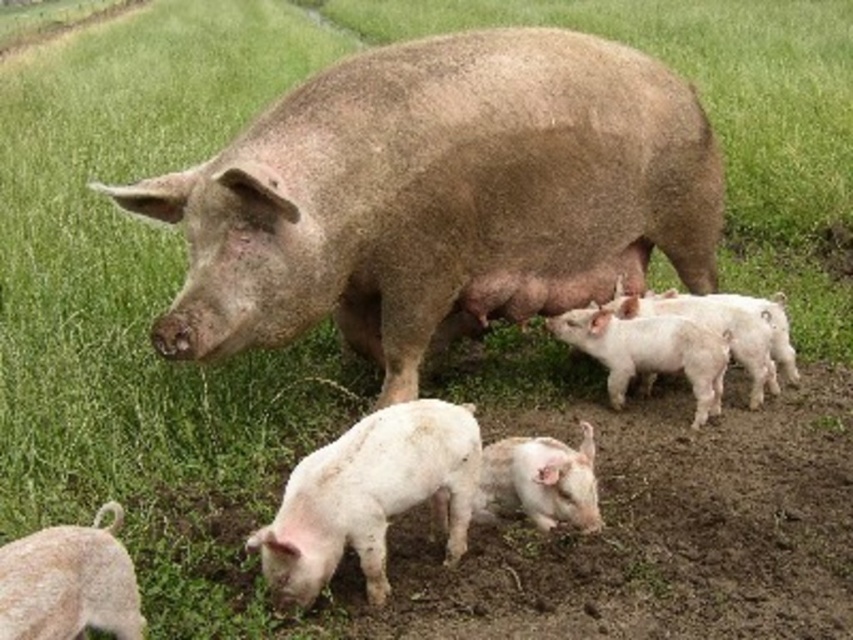
In the rural scene, you see a brown textured pig at center and a white fluffy piglet at lower left. Which animal is larger in size?

The brown textured pig at center is bigger than the white fluffy piglet at lower left.

You are a farmer checking the piglets in the field. You notice the white matte piglet at lower center and the white fluffy piglet at lower left. Which piglet is positioned more to the right side of the scene?

The white matte piglet at lower center is positioned more to the right side of the scene compared to the white fluffy piglet at lower left.

You are standing at the center of the field and see the point marked at coordinates (648, 352). What is located at that point?

The point at coordinates (648, 352) corresponds to the white matte piglets at center.